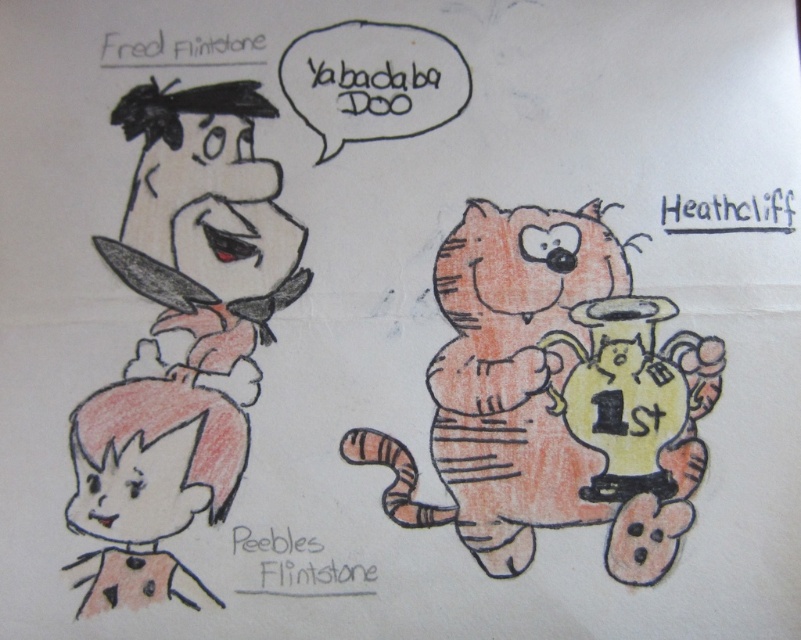
Question: Which of the following is the closest to the observer?

Choices:
 (A) (638, 550)
 (B) (151, 355)

Answer: (A)

Question: From the image, what is the correct spatial relationship of orange striped cat at right in relation to matte pink hair at lower left?

Choices:
 (A) right
 (B) left

Answer: (A)

Question: In this image, where is orange striped cat at right located relative to matte pink hair at lower left?

Choices:
 (A) right
 (B) left

Answer: (A)

Question: Which object appears farthest from the camera in this image?

Choices:
 (A) orange striped cat at right
 (B) matte pink hair at lower left

Answer: (B)

Question: Is the position of orange striped cat at right less distant than that of matte pink hair at lower left?

Choices:
 (A) no
 (B) yes

Answer: (B)